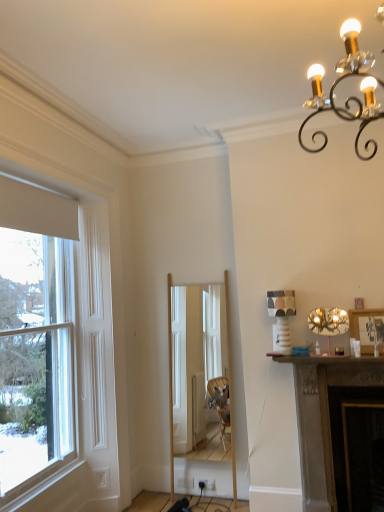
Question: From a real-world perspective, is metallic gold chandelier at upper right beneath dark brown stone fireplace at lower right?

Choices:
 (A) yes
 (B) no

Answer: (B)

Question: Could you tell me if metallic gold chandelier at upper right is turned towards dark brown stone fireplace at lower right?

Choices:
 (A) no
 (B) yes

Answer: (A)

Question: From the image's perspective, does metallic gold chandelier at upper right appear higher than dark brown stone fireplace at lower right?

Choices:
 (A) yes
 (B) no

Answer: (A)

Question: Is metallic gold chandelier at upper right taller than dark brown stone fireplace at lower right?

Choices:
 (A) yes
 (B) no

Answer: (B)

Question: Does metallic gold chandelier at upper right have a lesser height compared to dark brown stone fireplace at lower right?

Choices:
 (A) no
 (B) yes

Answer: (B)

Question: In terms of size, does metallic gold chandelier at upper right appear bigger or smaller than white wood window at left?

Choices:
 (A) big
 (B) small

Answer: (B)

Question: In the image, is metallic gold chandelier at upper right on the left side or the right side of white wood window at left?

Choices:
 (A) right
 (B) left

Answer: (A)

Question: Is metallic gold chandelier at upper right situated inside white wood window at left or outside?

Choices:
 (A) outside
 (B) inside

Answer: (A)

Question: Considering the positions of metallic gold chandelier at upper right and white wood window at left in the image, is metallic gold chandelier at upper right taller or shorter than white wood window at left?

Choices:
 (A) tall
 (B) short

Answer: (B)

Question: In terms of size, does dark brown stone fireplace at lower right appear bigger or smaller than white wood window at left?

Choices:
 (A) small
 (B) big

Answer: (B)

Question: Is dark brown stone fireplace at lower right in front of or behind white wood window at left in the image?

Choices:
 (A) front
 (B) behind

Answer: (B)

Question: Is dark brown stone fireplace at lower right wider or thinner than white wood window at left?

Choices:
 (A) thin
 (B) wide

Answer: (B)

Question: Does point (326, 467) appear closer or farther from the camera than point (39, 378)?

Choices:
 (A) farther
 (B) closer

Answer: (B)

Question: In the image, is dark brown stone fireplace at lower right positioned in front of or behind wooden framed picture at right?

Choices:
 (A) front
 (B) behind

Answer: (A)

Question: Is dark brown stone fireplace at lower right spatially inside wooden framed picture at right, or outside of it?

Choices:
 (A) inside
 (B) outside

Answer: (B)